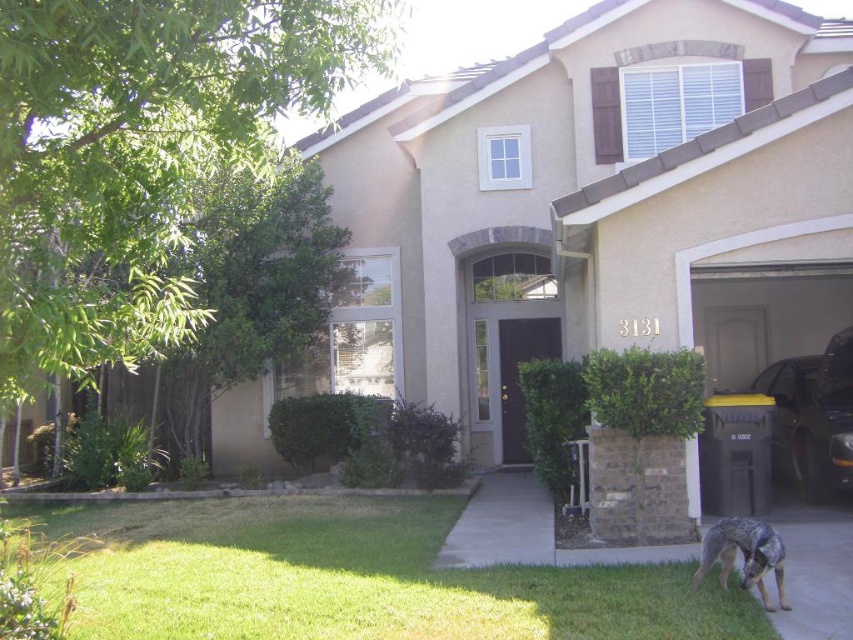
Question: Does green grass at lower left appear over green leafy bush at center?

Choices:
 (A) yes
 (B) no

Answer: (B)

Question: Does green grass at lower left appear over metallic dark gray car at right?

Choices:
 (A) yes
 (B) no

Answer: (B)

Question: Which point is farther from the camera taking this photo?

Choices:
 (A) (566, 467)
 (B) (764, 557)
 (C) (299, 403)

Answer: (C)

Question: Which of the following is the farthest from the observer?

Choices:
 (A) (679, 614)
 (B) (762, 390)
 (C) (585, 435)
 (D) (308, 397)

Answer: (D)

Question: Which point is closer to the camera taking this photo?

Choices:
 (A) (839, 387)
 (B) (715, 556)
 (C) (347, 422)

Answer: (B)

Question: Is green leafy hedge at center further to camera compared to blue-gray fur dog at lower right?

Choices:
 (A) yes
 (B) no

Answer: (A)